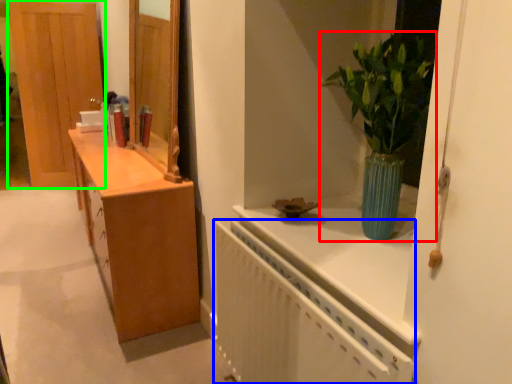
Question: Which object is positioned farthest from houseplant (highlighted by a red box)? Select from radiator (highlighted by a blue box) and door (highlighted by a green box).

Choices:
 (A) radiator
 (B) door

Answer: (B)